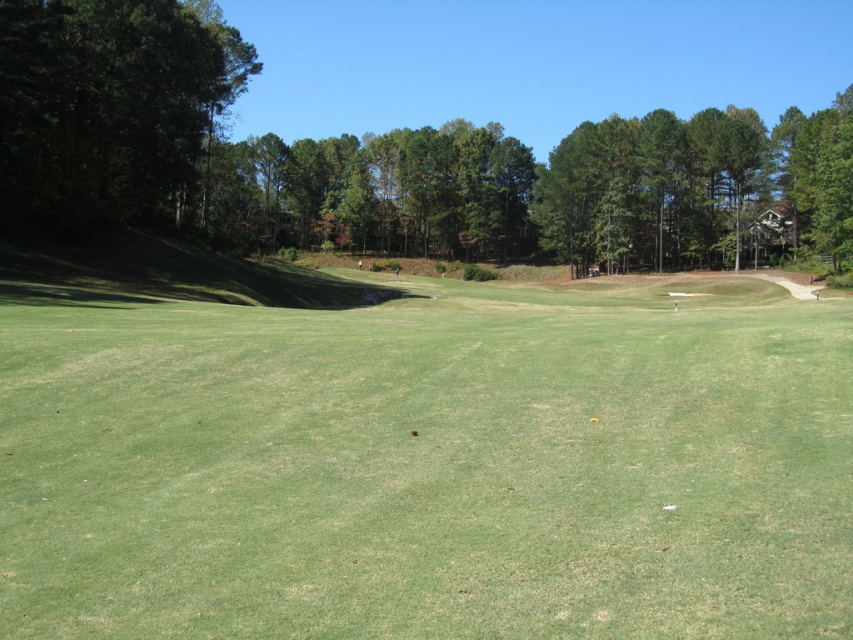
Question: Is green grassy field at center positioned in front of dark green leafy tree at left?

Choices:
 (A) yes
 (B) no

Answer: (A)

Question: Can you confirm if green grassy field at center is smaller than dark green leafy tree at left?

Choices:
 (A) no
 (B) yes

Answer: (B)

Question: Among these points, which one is farthest from the camera?

Choices:
 (A) (334, 180)
 (B) (28, 106)

Answer: (A)

Question: Does green grassy field at center have a smaller size compared to green leafy trees at upper center?

Choices:
 (A) no
 (B) yes

Answer: (B)

Question: Based on their relative distances, which object is farther from the green grassy field at center?

Choices:
 (A) green leafy trees at upper center
 (B) dark green leafy tree at left

Answer: (A)

Question: Which point appears farthest from the camera in this image?

Choices:
 (A) (485, 138)
 (B) (189, 106)

Answer: (A)